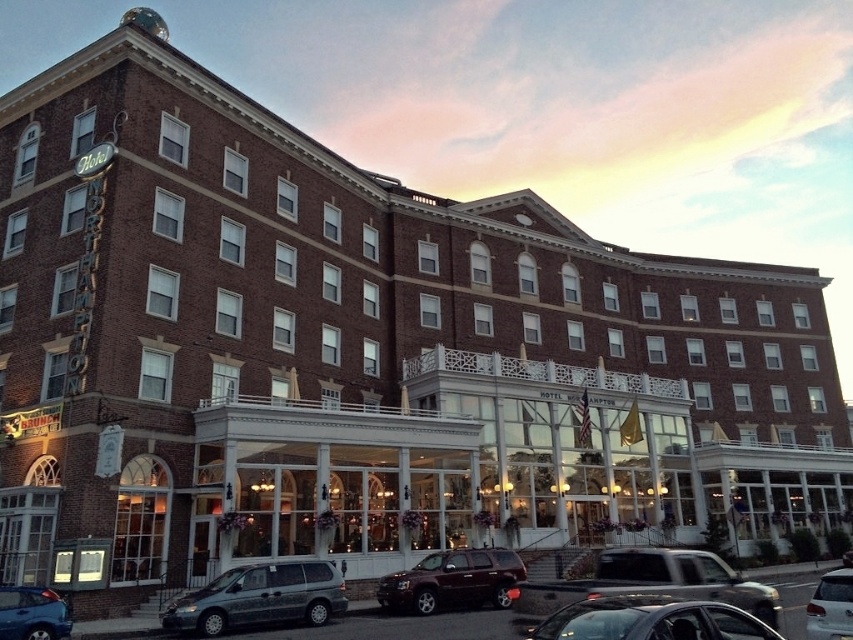
Question: From the image, what is the correct spatial relationship of metallic blue sedan at lower left in relation to white glossy sedan at lower right?

Choices:
 (A) right
 (B) left

Answer: (B)

Question: Estimate the real-world distances between objects in this image. Which object is farther from the shiny silver sedan at lower center?

Choices:
 (A) metallic silver truck at lower center
 (B) metallic blue sedan at lower left
 (C) shiny dark brown suv at center
 (D) white glossy sedan at lower right

Answer: (B)

Question: Is shiny silver sedan at lower center closer to the viewer compared to shiny dark brown suv at center?

Choices:
 (A) yes
 (B) no

Answer: (A)

Question: Which point appears farthest from the camera in this image?

Choices:
 (A) (849, 570)
 (B) (215, 611)
 (C) (399, 593)
 (D) (45, 624)

Answer: (A)

Question: Estimate the real-world distances between objects in this image. Which object is farther from the shiny silver sedan at lower center?

Choices:
 (A) metallic gray minivan at lower left
 (B) metallic blue sedan at lower left

Answer: (B)

Question: Is metallic silver truck at lower center to the right of white glossy sedan at lower right from the viewer's perspective?

Choices:
 (A) yes
 (B) no

Answer: (B)